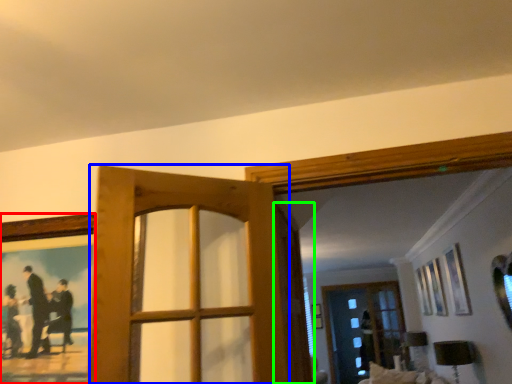
Question: Which object is positioned closest to picture frame (highlighted by a red box)? Select from door (highlighted by a blue box) and screen door (highlighted by a green box).

Choices:
 (A) door
 (B) screen door

Answer: (A)